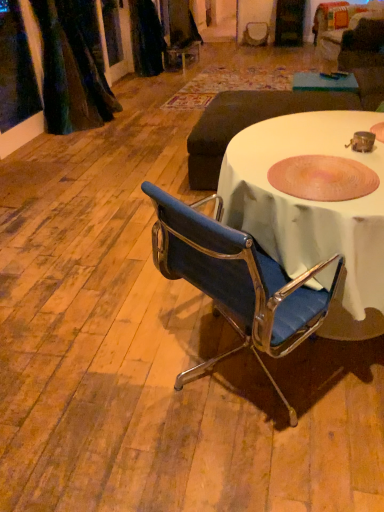
Measure the distance between pink textured bowl at center and camera.

pink textured bowl at center is 1.30 meters from camera.

The height and width of the screenshot is (512, 384). What do you see at coordinates (73, 67) in the screenshot?
I see `velvet dark green curtain at upper left` at bounding box center [73, 67].

Find the location of `velvet dark green curtain at upper left`. velvet dark green curtain at upper left is located at coordinates (73, 67).

At what (x,y) coordinates should I click in order to perform the action: click on dark gray fabric ottoman at center. Please return your answer as a coordinate pair (x, y). The height and width of the screenshot is (512, 384). Looking at the image, I should click on (248, 123).

This screenshot has width=384, height=512. In order to click on green felt table at upper center in this screenshot , I will do `click(324, 82)`.

From a real-world perspective, who is located lower, dark gray fabric ottoman at center or pink textured bowl at center?

dark gray fabric ottoman at center, from a real-world perspective.

Is dark gray fabric ottoman at center oriented towards pink textured bowl at center?

No, dark gray fabric ottoman at center is not oriented towards pink textured bowl at center.

Between dark gray fabric ottoman at center and pink textured bowl at center, which one has smaller size?

pink textured bowl at center.

Which of these two, dark gray fabric ottoman at center or pink textured bowl at center, is wider?

With larger width is dark gray fabric ottoman at center.

Is green felt table at upper center at the left side of velvet dark green curtain at upper left?

No, green felt table at upper center is not to the left of velvet dark green curtain at upper left.

Which of these two, green felt table at upper center or velvet dark green curtain at upper left, is wider?

Wider between the two is green felt table at upper center.

How far apart are green felt table at upper center and velvet dark green curtain at upper left?

green felt table at upper center and velvet dark green curtain at upper left are 2.20 meters apart from each other.

At what (x,y) coordinates should I click in order to perform the action: click on curtain in front of the green felt table at upper center. Please return your answer as a coordinate pair (x, y). Image resolution: width=384 pixels, height=512 pixels. Looking at the image, I should click on (73, 67).

Can you tell me how much dark gray fabric ottoman at center and blue fabric chair at center differ in facing direction?

0.282 degrees.

In the scene shown: From the image's perspective, is dark gray fabric ottoman at center under blue fabric chair at center?

No, from the image's perspective, dark gray fabric ottoman at center is not below blue fabric chair at center.

How distant is dark gray fabric ottoman at center from blue fabric chair at center?

dark gray fabric ottoman at center and blue fabric chair at center are 1.69 meters apart from each other.

Locate an element on the screen. studio couch on the right of blue fabric chair at center is located at coordinates (248, 123).

Between blue fabric chair at center and green felt table at upper center, which one has less height?

With less height is green felt table at upper center.

In terms of size, does blue fabric chair at center appear bigger or smaller than green felt table at upper center?

Considering their sizes, blue fabric chair at center takes up more space than green felt table at upper center.

Is blue fabric chair at center wider or thinner than green felt table at upper center?

blue fabric chair at center is wider than green felt table at upper center.

How much distance is there between blue fabric chair at center and green felt table at upper center?

The distance of blue fabric chair at center from green felt table at upper center is 9.13 feet.

Are blue fabric chair at center and velvet dark green curtain at upper left far apart?

Result: Yes, blue fabric chair at center and velvet dark green curtain at upper left are quite far apart.

Is point (294, 316) positioned behind point (82, 87)?

No, it is not.

Is blue fabric chair at center smaller than velvet dark green curtain at upper left?

No, blue fabric chair at center is not smaller than velvet dark green curtain at upper left.

Can you confirm if velvet dark green curtain at upper left is shorter than green felt table at upper center?

No, velvet dark green curtain at upper left is not shorter than green felt table at upper center.

Is velvet dark green curtain at upper left at the right side of green felt table at upper center?

No, velvet dark green curtain at upper left is not to the right of green felt table at upper center.

From the image's perspective, is velvet dark green curtain at upper left beneath green felt table at upper center?

Incorrect, from the image's perspective, velvet dark green curtain at upper left is higher than green felt table at upper center.

Does velvet dark green curtain at upper left have a greater width compared to blue fabric chair at center?

No.

Find the location of a particular element. chair below the velvet dark green curtain at upper left (from a real-world perspective) is located at coordinates (237, 282).

Is point (88, 125) farther from viewer compared to point (249, 312)?

Yes, point (88, 125) is farther from viewer.

This screenshot has height=512, width=384. In the image, there is a dark gray fabric ottoman at center. Identify the location of bowl below it (from the image's perspective). (322, 178).

Where is `curtain above the green felt table at upper center (from the image's perspective)`? curtain above the green felt table at upper center (from the image's perspective) is located at coordinates (73, 67).

Which object lies further to the anchor point blue fabric chair at center, pink textured bowl at center or velvet dark green curtain at upper left?

The object further to blue fabric chair at center is velvet dark green curtain at upper left.

Based on their spatial positions, is green felt table at upper center or pink textured bowl at center closer to dark gray fabric ottoman at center?

green felt table at upper center.

When comparing their distances from velvet dark green curtain at upper left, does blue fabric chair at center or pink textured bowl at center seem closer?

Among the two, blue fabric chair at center is located nearer to velvet dark green curtain at upper left.

When comparing their distances from green felt table at upper center, does velvet dark green curtain at upper left or pink textured bowl at center seem closer?

velvet dark green curtain at upper left.

Based on their spatial positions, is green felt table at upper center or velvet dark green curtain at upper left closer to dark gray fabric ottoman at center?

green felt table at upper center is positioned closer to the anchor dark gray fabric ottoman at center.

Based on their spatial positions, is green felt table at upper center or dark gray fabric ottoman at center further from velvet dark green curtain at upper left?

green felt table at upper center.

From the image, which object appears to be nearer to dark gray fabric ottoman at center, pink textured bowl at center or blue fabric chair at center?

pink textured bowl at center lies closer to dark gray fabric ottoman at center than the other object.

From the image, which object appears to be farther from blue fabric chair at center, green felt table at upper center or pink textured bowl at center?

The object further to blue fabric chair at center is green felt table at upper center.

Locate an element on the screen. The image size is (384, 512). curtain positioned between blue fabric chair at center and green felt table at upper center from near to far is located at coordinates (73, 67).

You are a GUI agent. You are given a task and a screenshot of the screen. Output one action in this format:
    pyautogui.click(x=<x>, y=<y>)
    Task: Click on the curtain positioned between pink textured bowl at center and green felt table at upper center from near to far
    Image resolution: width=384 pixels, height=512 pixels.
    Given the screenshot: What is the action you would take?
    pyautogui.click(x=73, y=67)

This screenshot has height=512, width=384. I want to click on studio couch between velvet dark green curtain at upper left and green felt table at upper center, so click(x=248, y=123).

Where is `bowl positioned between blue fabric chair at center and velvet dark green curtain at upper left from near to far`? The image size is (384, 512). bowl positioned between blue fabric chair at center and velvet dark green curtain at upper left from near to far is located at coordinates (322, 178).